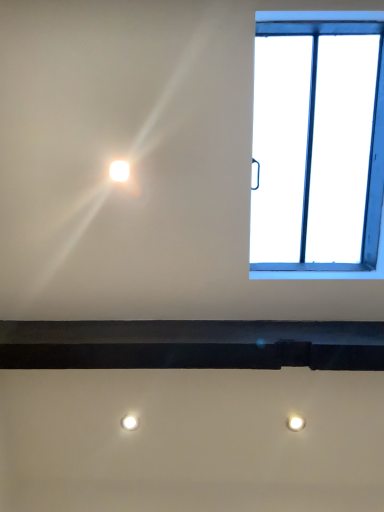
What is the approximate height of blue metallic window at upper right?

It is 25.63 inches.

What do you see at coordinates (331, 271) in the screenshot?
I see `blue metallic window at upper right` at bounding box center [331, 271].

What are the coordinates of `blue metallic window at upper right` in the screenshot? It's located at (331, 271).

Locate an element on the screen. blue metallic window at upper right is located at coordinates (331, 271).